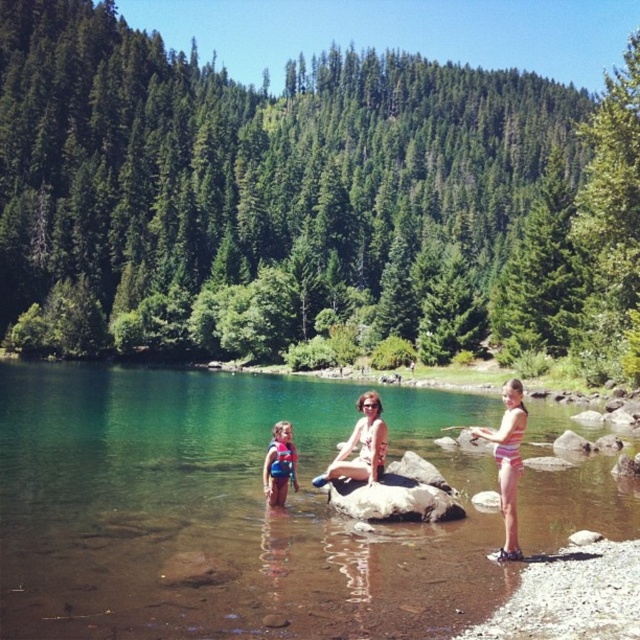
Measure the distance from clear water at center to matte white bikini at center.

The distance of clear water at center from matte white bikini at center is 12.37 meters.

This screenshot has width=640, height=640. I want to click on clear water at center, so click(205, 516).

Is point (248, 545) closer to camera compared to point (352, 442)?

Yes, it is in front of point (352, 442).

Find the location of a particular element. This screenshot has height=640, width=640. clear water at center is located at coordinates (205, 516).

Can you confirm if clear water at center is positioned to the left of red life vest at center?

In fact, clear water at center is to the right of red life vest at center.

Can you confirm if clear water at center is positioned above red life vest at center?

Actually, clear water at center is below red life vest at center.

Where is `clear water at center`? This screenshot has width=640, height=640. clear water at center is located at coordinates (205, 516).

Is striped swimsuit at right in front of matte white bikini at center?

Yes, striped swimsuit at right is closer to the viewer.

How much distance is there between striped swimsuit at right and matte white bikini at center?

striped swimsuit at right is 4.13 meters from matte white bikini at center.

You are a GUI agent. You are given a task and a screenshot of the screen. Output one action in this format:
    pyautogui.click(x=<x>, y=<y>)
    Task: Click on the striped swimsuit at right
    This screenshot has width=640, height=640.
    Given the screenshot: What is the action you would take?
    pyautogui.click(x=508, y=461)

Locate an element on the screen. striped swimsuit at right is located at coordinates (508, 461).